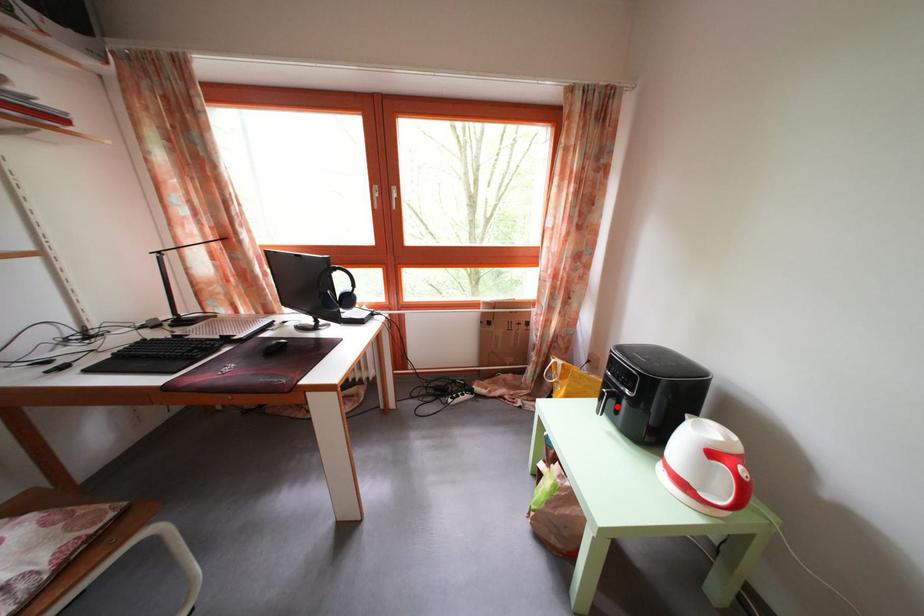
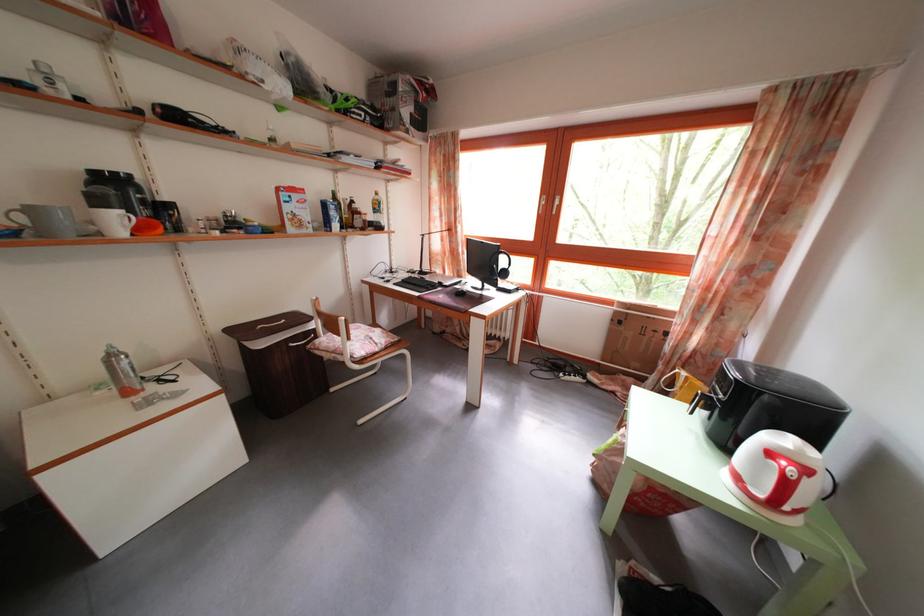
Question: I am providing you with two images of the same scene from different viewpoints. In image1, a red point is highlighted. Considering the same 3D point in image2, which of the following is correct?

Choices:
 (A) It is closer
 (B) It is farther

Answer: (B)